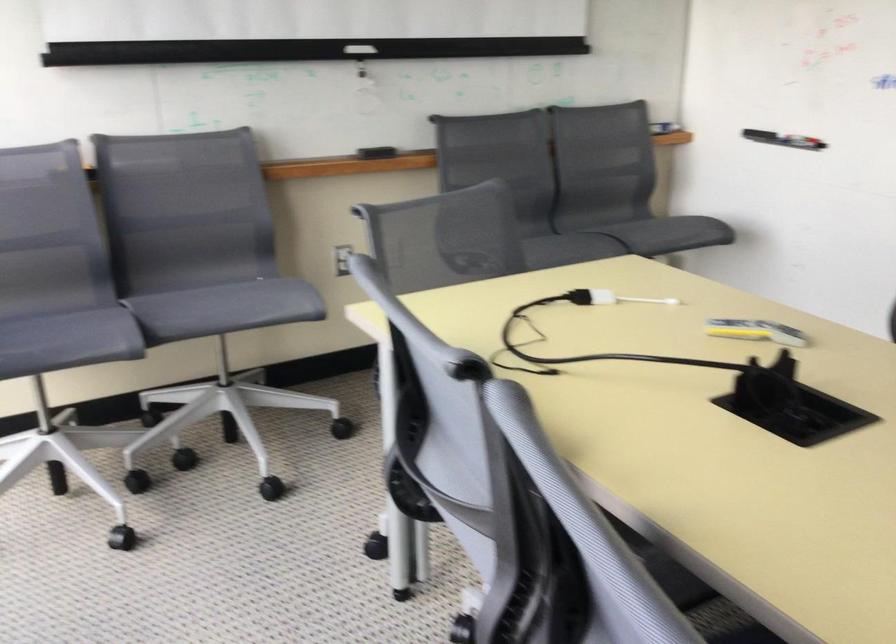
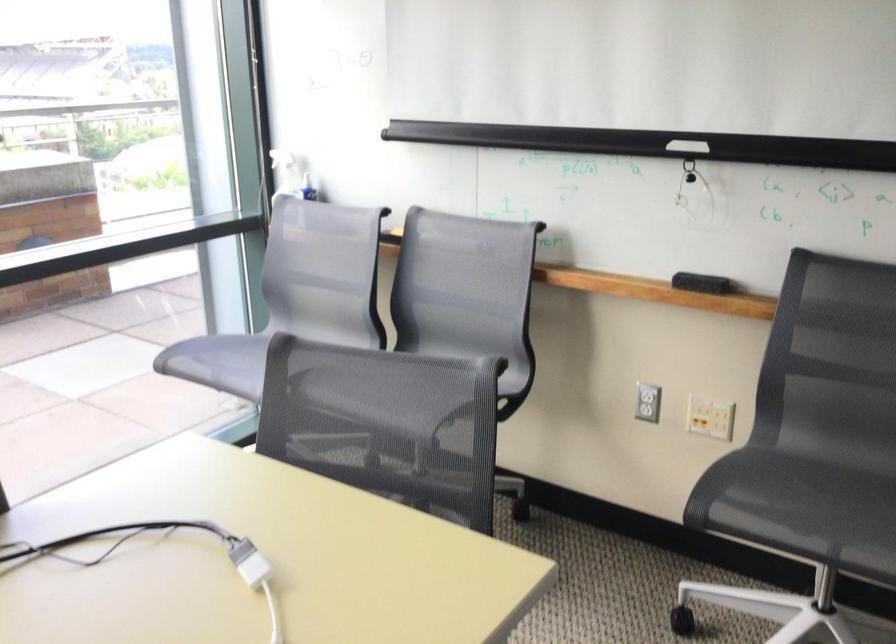
Find the pixel in the second image that matches point (147, 265) in the first image.

(426, 337)